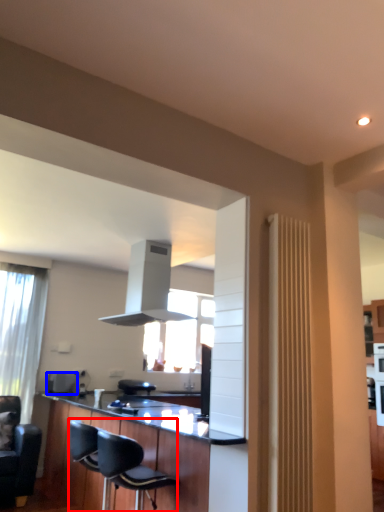
Question: Among these objects, which one is farthest to the camera, chair (highlighted by a red box) or appliance (highlighted by a blue box)?

Choices:
 (A) chair
 (B) appliance

Answer: (B)